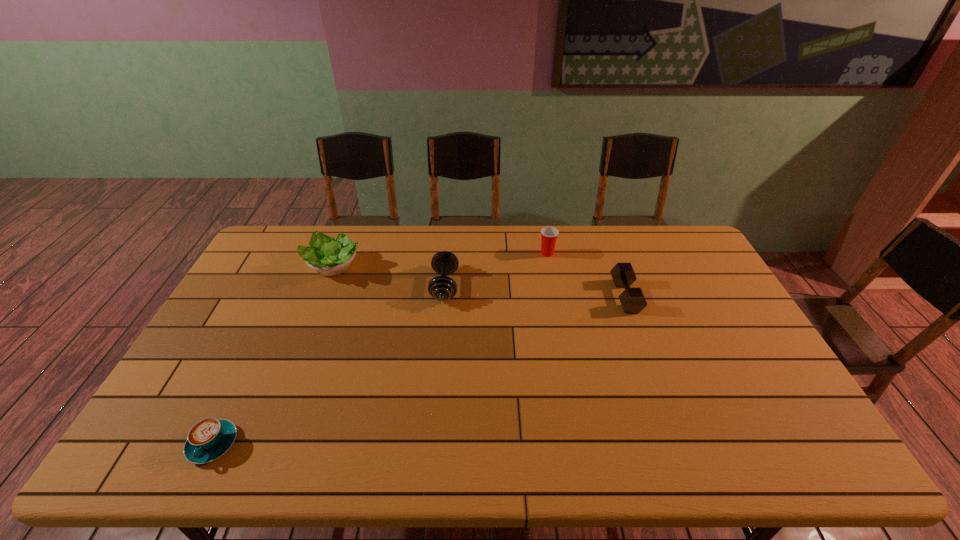
Image resolution: width=960 pixels, height=540 pixels. Identify the location of vacant space that's between the rightmost object and the Dixie cup. (587, 275).

Identify the location of vacant point located between the cappuccino and the third object from right to left. Image resolution: width=960 pixels, height=540 pixels. (328, 364).

The height and width of the screenshot is (540, 960). In order to click on vacant space in between the lettuce and the cappuccino in this screenshot , I will do `click(273, 356)`.

Where is `object that is the fourth closest to the Dixie cup`? object that is the fourth closest to the Dixie cup is located at coordinates (210, 438).

I want to click on the fourth closest object to the lettuce, so click(x=632, y=300).

The height and width of the screenshot is (540, 960). In order to click on vacant space that satisfies the following two spatial constraints: 1. on the front side of the lettuce; 2. on the right side of the rightmost object in this screenshot , I will do `click(321, 296)`.

I want to click on blank area in the image that satisfies the following two spatial constraints: 1. on the front side of the shorter dumbbell; 2. on the right side of the second object from right to left, so coord(555,296).

This screenshot has height=540, width=960. Find the location of `vacant region that satisfies the following two spatial constraints: 1. on the back side of the fourth object from left to right; 2. on the right side of the taller dumbbell`. vacant region that satisfies the following two spatial constraints: 1. on the back side of the fourth object from left to right; 2. on the right side of the taller dumbbell is located at coordinates (447, 253).